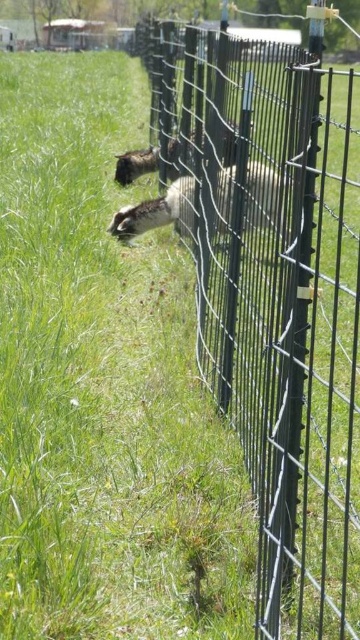
Which of these two, black wire fence at center or white woolen sheep at center, stands taller?

Standing taller between the two is black wire fence at center.

This screenshot has height=640, width=360. What are the coordinates of `black wire fence at center` in the screenshot? It's located at (280, 307).

Locate an element on the screen. This screenshot has width=360, height=640. black wire fence at center is located at coordinates (280, 307).